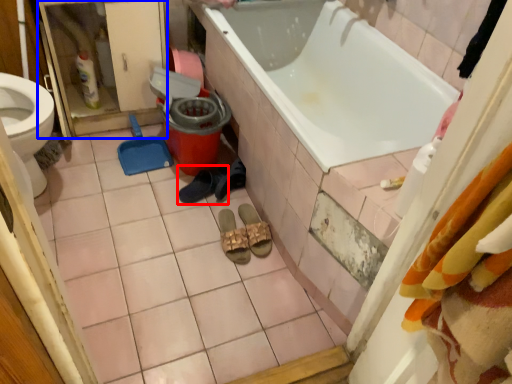
Question: Which object is further to the camera taking this photo, footwear (highlighted by a red box) or screen door (highlighted by a blue box)?

Choices:
 (A) footwear
 (B) screen door

Answer: (A)